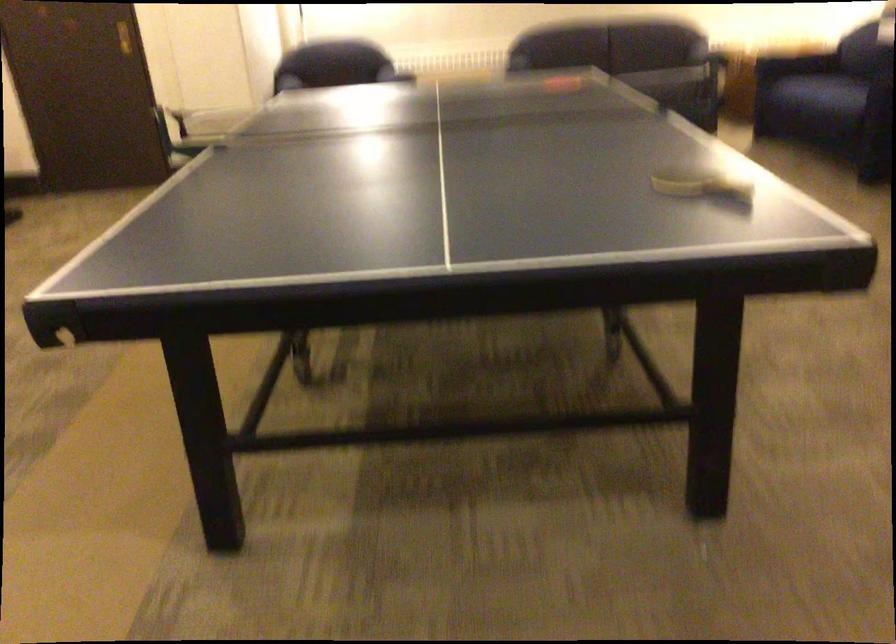
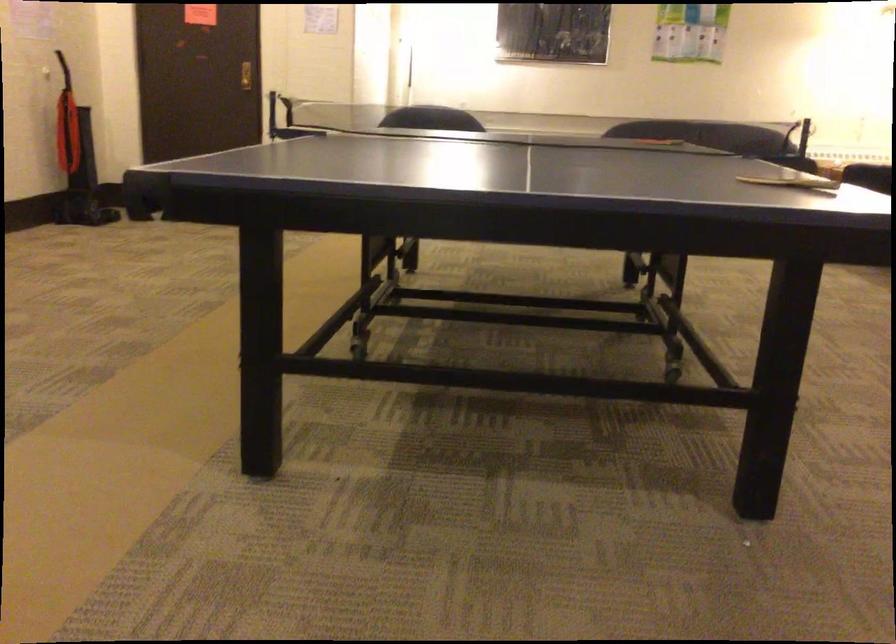
Question: Based on the continuous images, in which direction is the camera rotating? Reply with the corresponding letter.

Choices:
 (A) Left
 (B) Right
 (C) Up
 (D) Down

Answer: (C)